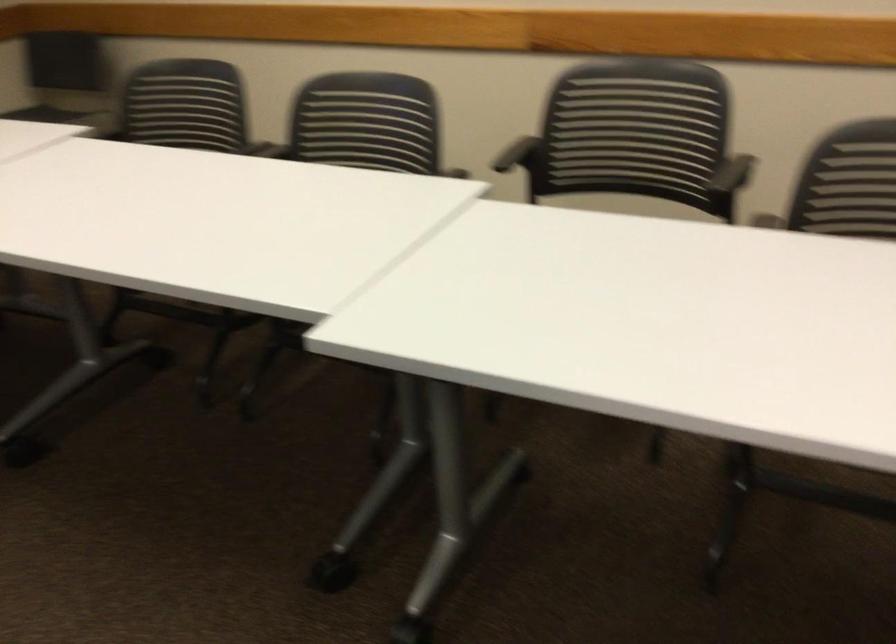
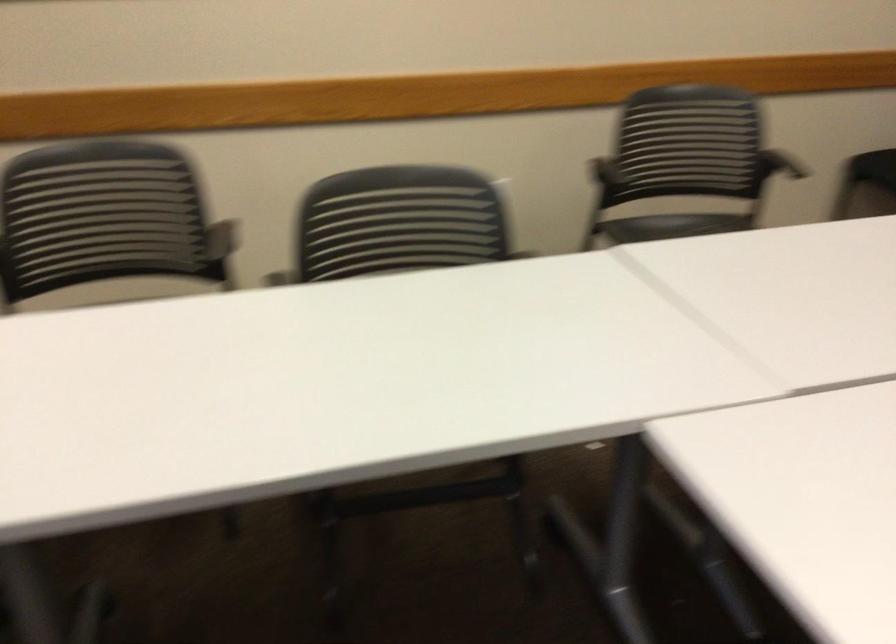
Locate, in the second image, the point that corresponds to point 725,175 in the first image.

(211, 242)